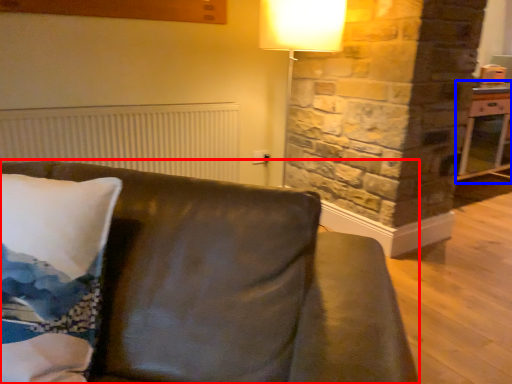
Question: Which object is closer to the camera taking this photo, studio couch (highlighted by a red box) or table (highlighted by a blue box)?

Choices:
 (A) studio couch
 (B) table

Answer: (A)